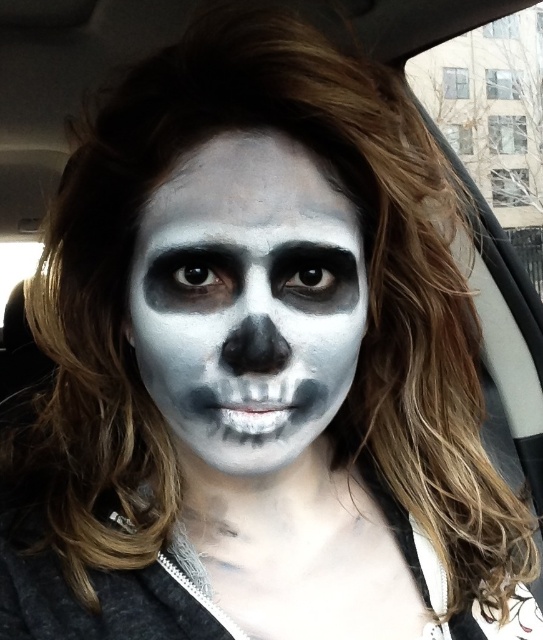
Looking at this image, is white matte skull makeup at center bigger than white matte skeleton face paint at center?

No, white matte skull makeup at center is not bigger than white matte skeleton face paint at center.

Can you confirm if white matte skull makeup at center is smaller than white matte skeleton face paint at center?

Correct, white matte skull makeup at center occupies less space than white matte skeleton face paint at center.

Consider the image. Who is more forward, (x=324, y=192) or (x=209, y=620)?

Point (x=324, y=192)

The width and height of the screenshot is (543, 640). Identify the location of white matte skull makeup at center. click(248, 300).